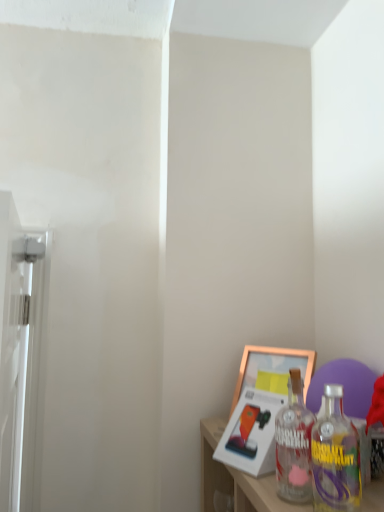
How much space does gold metallic picture frame at lower right, arranged as the first picture frame when viewed from the back, occupy horizontally?

3.85 inches.

From the picture: What is the approximate width of clear glass bottle at lower right?

4.37 inches.

You are a GUI agent. You are given a task and a screenshot of the screen. Output one action in this format:
    pyautogui.click(x=<x>, y=<y>)
    Task: Click on the gold metallic picture frame at lower right, marked as the second picture frame in a front-to-back arrangement
    
    Given the screenshot: What is the action you would take?
    pyautogui.click(x=272, y=368)

Does point (307, 374) lie in front of point (257, 405)?

No, (307, 374) is behind (257, 405).

Is gold metallic picture frame at lower right, arranged as the first picture frame when viewed from the back, with gold metallic picture frame at lower right, acting as the 2th picture frame starting from the back?

Yes, gold metallic picture frame at lower right, arranged as the first picture frame when viewed from the back, is beside gold metallic picture frame at lower right, acting as the 2th picture frame starting from the back.

From a real-world perspective, is gold metallic picture frame at lower right, marked as the second picture frame in a front-to-back arrangement, located beneath gold metallic picture frame at lower right, acting as the 2th picture frame starting from the back?

No, from a real-world perspective, gold metallic picture frame at lower right, marked as the second picture frame in a front-to-back arrangement, is not below gold metallic picture frame at lower right, acting as the 2th picture frame starting from the back.

Where is `picture frame below the gold metallic picture frame at lower right, marked as the second picture frame in a front-to-back arrangement (from a real-world perspective)`? Image resolution: width=384 pixels, height=512 pixels. picture frame below the gold metallic picture frame at lower right, marked as the second picture frame in a front-to-back arrangement (from a real-world perspective) is located at coordinates (262, 404).

How different are the orientations of clear glass bottle at lower right and gold metallic picture frame at lower right, which is counted as the first picture frame, starting from the front, in degrees?

7.85 degrees.

Is point (281, 459) positioned after point (220, 448)?

No, it is not.

Relative to gold metallic picture frame at lower right, which is counted as the first picture frame, starting from the front, is clear glass bottle at lower right in front or behind?

Clearly, clear glass bottle at lower right is in front of gold metallic picture frame at lower right, which is counted as the first picture frame, starting from the front.

Can you confirm if gold metallic picture frame at lower right, acting as the 2th picture frame starting from the back, is smaller than gold metallic picture frame at lower right, marked as the second picture frame in a front-to-back arrangement?

Correct, gold metallic picture frame at lower right, acting as the 2th picture frame starting from the back, occupies less space than gold metallic picture frame at lower right, marked as the second picture frame in a front-to-back arrangement.

Looking at this image, is gold metallic picture frame at lower right, acting as the 2th picture frame starting from the back, facing towards gold metallic picture frame at lower right, marked as the second picture frame in a front-to-back arrangement?

No.

Considering the sizes of gold metallic picture frame at lower right, acting as the 2th picture frame starting from the back, and gold metallic picture frame at lower right, marked as the second picture frame in a front-to-back arrangement, in the image, is gold metallic picture frame at lower right, acting as the 2th picture frame starting from the back, wider or thinner than gold metallic picture frame at lower right, marked as the second picture frame in a front-to-back arrangement,?

Considering their sizes, gold metallic picture frame at lower right, acting as the 2th picture frame starting from the back, looks broader than gold metallic picture frame at lower right, marked as the second picture frame in a front-to-back arrangement.

Which is behind, white glossy screen door at left or gold metallic picture frame at lower right, arranged as the first picture frame when viewed from the back?

gold metallic picture frame at lower right, arranged as the first picture frame when viewed from the back, is behind.

Which object is thinner, white glossy screen door at left or gold metallic picture frame at lower right, marked as the second picture frame in a front-to-back arrangement?

gold metallic picture frame at lower right, marked as the second picture frame in a front-to-back arrangement.

From the image's perspective, which is above, white glossy screen door at left or gold metallic picture frame at lower right, marked as the second picture frame in a front-to-back arrangement?

white glossy screen door at left is shown above in the image.

Can you tell me how much white glossy screen door at left and gold metallic picture frame at lower right, arranged as the first picture frame when viewed from the back, differ in facing direction?

There is a 27.5-degree angle between the facing directions of white glossy screen door at left and gold metallic picture frame at lower right, arranged as the first picture frame when viewed from the back.

From the image's perspective, between white glossy screen door at left and clear glass bottle at lower right, who is located below?

From the image's view, white glossy screen door at left is below.

Is point (39, 441) in front of point (304, 451)?

That is False.

Who is taller, white glossy screen door at left or clear glass bottle at lower right?

white glossy screen door at left is taller.

Can you confirm if white glossy screen door at left is positioned to the right of clear glass bottle at lower right?

No.

In the image, is clear glass bottle at lower right positioned in front of or behind white glossy screen door at left?

Visually, clear glass bottle at lower right is located behind white glossy screen door at left.

Which of these two, clear glass bottle at lower right or white glossy screen door at left, stands taller?

white glossy screen door at left.

Between clear glass bottle at lower right and white glossy screen door at left, which one appears on the right side from the viewer's perspective?

clear glass bottle at lower right is more to the right.

Can you confirm if clear glass bottle at lower right is bigger than white glossy screen door at left?

Incorrect, clear glass bottle at lower right is not larger than white glossy screen door at left.

From the picture: Is gold metallic picture frame at lower right, marked as the second picture frame in a front-to-back arrangement, wider than white glossy screen door at left?

No, gold metallic picture frame at lower right, marked as the second picture frame in a front-to-back arrangement, is not wider than white glossy screen door at left.

Between gold metallic picture frame at lower right, marked as the second picture frame in a front-to-back arrangement, and white glossy screen door at left, which one has smaller size?

With smaller size is gold metallic picture frame at lower right, marked as the second picture frame in a front-to-back arrangement.

Does gold metallic picture frame at lower right, marked as the second picture frame in a front-to-back arrangement, have a lesser height compared to white glossy screen door at left?

Yes, gold metallic picture frame at lower right, marked as the second picture frame in a front-to-back arrangement, is shorter than white glossy screen door at left.

In the scene shown: From the image's perspective, is gold metallic picture frame at lower right, marked as the second picture frame in a front-to-back arrangement, beneath white glossy screen door at left?

Correct, gold metallic picture frame at lower right, marked as the second picture frame in a front-to-back arrangement, appears lower than white glossy screen door at left in the image.

Identify the location of picture frame that appears below the gold metallic picture frame at lower right, marked as the second picture frame in a front-to-back arrangement (from the image's perspective). (262, 404).

There is a gold metallic picture frame at lower right, which is counted as the first picture frame, starting from the front. Where is `bottle above it (from a real-world perspective)`? The image size is (384, 512). bottle above it (from a real-world perspective) is located at coordinates (294, 445).

From the picture: Looking at the image, which one is located further to gold metallic picture frame at lower right, marked as the second picture frame in a front-to-back arrangement, gold metallic picture frame at lower right, which is counted as the first picture frame, starting from the front, or white glossy screen door at left?

white glossy screen door at left is further to gold metallic picture frame at lower right, marked as the second picture frame in a front-to-back arrangement.

Which object lies further to the anchor point white glossy screen door at left, gold metallic picture frame at lower right, acting as the 2th picture frame starting from the back, or clear glass bottle at lower right?

clear glass bottle at lower right lies further to white glossy screen door at left than the other object.

Based on their spatial positions, is gold metallic picture frame at lower right, which is counted as the first picture frame, starting from the front, or gold metallic picture frame at lower right, arranged as the first picture frame when viewed from the back, closer to white glossy screen door at left?

Based on the image, gold metallic picture frame at lower right, which is counted as the first picture frame, starting from the front, appears to be nearer to white glossy screen door at left.

From the image, which object appears to be nearer to white glossy screen door at left, clear glass bottle at lower right or gold metallic picture frame at lower right, marked as the second picture frame in a front-to-back arrangement?

clear glass bottle at lower right is positioned closer to the anchor white glossy screen door at left.

Based on their spatial positions, is gold metallic picture frame at lower right, which is counted as the first picture frame, starting from the front, or white glossy screen door at left closer to clear glass bottle at lower right?

The object closer to clear glass bottle at lower right is gold metallic picture frame at lower right, which is counted as the first picture frame, starting from the front.

Estimate the real-world distances between objects in this image. Which object is further from gold metallic picture frame at lower right, marked as the second picture frame in a front-to-back arrangement, gold metallic picture frame at lower right, acting as the 2th picture frame starting from the back, or clear glass bottle at lower right?

Among the two, clear glass bottle at lower right is located further to gold metallic picture frame at lower right, marked as the second picture frame in a front-to-back arrangement.

When comparing their distances from clear glass bottle at lower right, does white glossy screen door at left or gold metallic picture frame at lower right, which is counted as the first picture frame, starting from the front, seem further?

white glossy screen door at left lies further to clear glass bottle at lower right than the other object.

When comparing their distances from gold metallic picture frame at lower right, which is counted as the first picture frame, starting from the front, does clear glass bottle at lower right or white glossy screen door at left seem closer?

clear glass bottle at lower right lies closer to gold metallic picture frame at lower right, which is counted as the first picture frame, starting from the front, than the other object.

In order to click on bottle between white glossy screen door at left and gold metallic picture frame at lower right, marked as the second picture frame in a front-to-back arrangement, from left to right in this screenshot , I will do [x=294, y=445].

The width and height of the screenshot is (384, 512). In order to click on picture frame located between white glossy screen door at left and gold metallic picture frame at lower right, marked as the second picture frame in a front-to-back arrangement, in the left-right direction in this screenshot , I will do `click(262, 404)`.

What are the coordinates of `picture frame situated between white glossy screen door at left and clear glass bottle at lower right from left to right` in the screenshot? It's located at (262, 404).

I want to click on picture frame between clear glass bottle at lower right and gold metallic picture frame at lower right, arranged as the first picture frame when viewed from the back, along the z-axis, so click(262, 404).